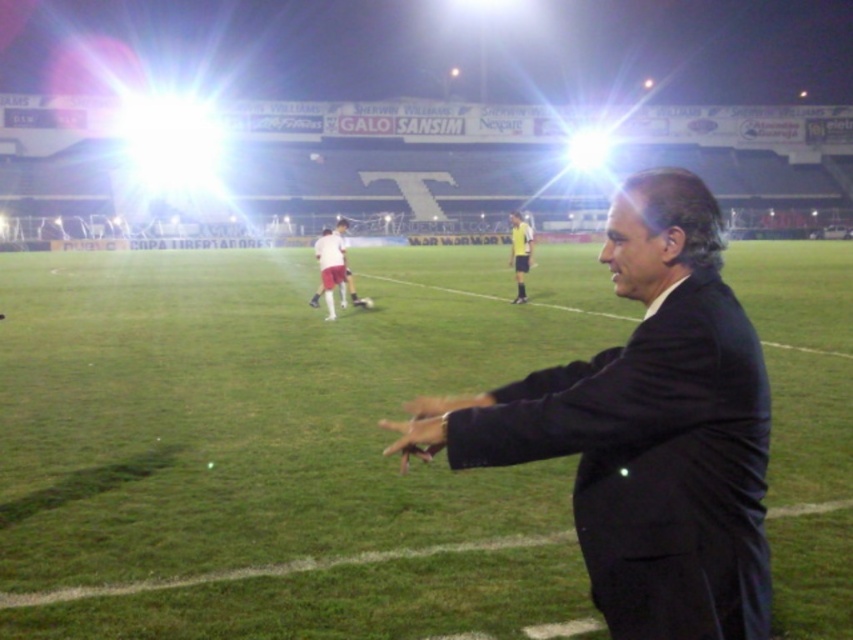
You are a drone operator trying to capture a nighttime soccer field scene. Your drone is currently hovering above the green grass at center. If you move the drone straight down, will it land on the black suit at right?

The green grass at center is located above the black suit at right, so moving the drone straight down from the green grass at center would not land it on the black suit at right since the black suit at right is below it.

You are standing at the edge of the soccer field and want to walk towards the green grass at center and the black suit at right. Which object will you encounter first?

The green grass at center is further to the viewer than the black suit at right, so you will encounter the black suit at right first because it is closer to you.

You are a drone operator trying to capture a photo of the soccer field at night. Your drone is currently hovering above the black suit at right. To frame the green grass at center in your shot, should you move the drone to the left or to the right?

The green grass at center is to the right of the black suit at right, so you should move the drone to the right to frame the green grass at center in your shot.